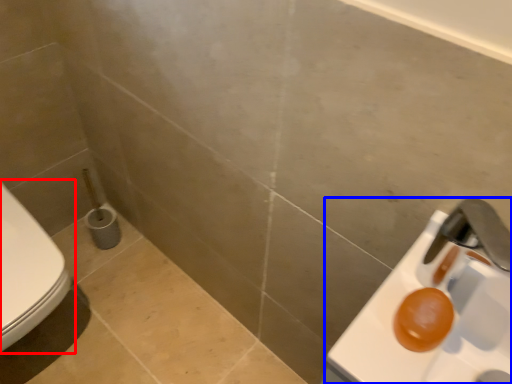
Question: Which point is further to the camera, toilet (highlighted by a red box) or sink (highlighted by a blue box)?

Choices:
 (A) toilet
 (B) sink

Answer: (A)